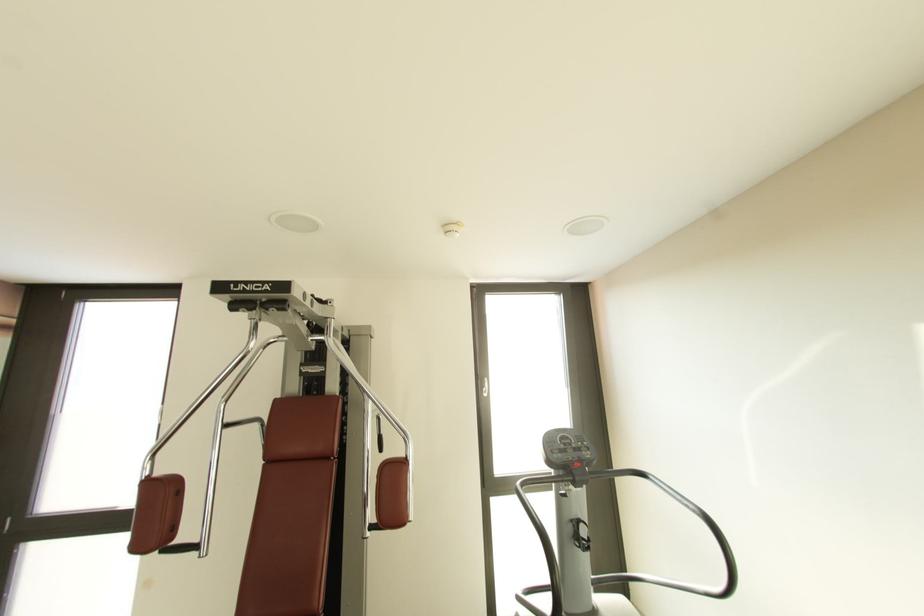
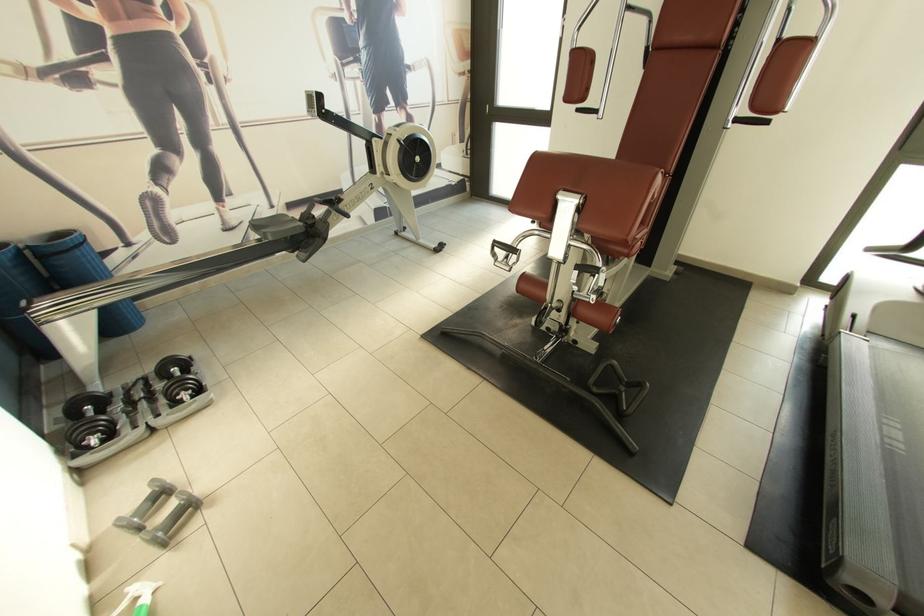
The point at (378, 530) is marked in the first image. Where is the corresponding point in the second image?

(742, 121)